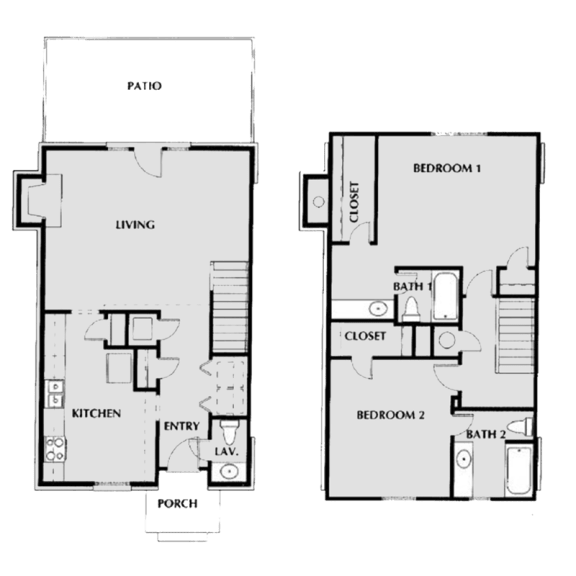
Identify the location of sinks. This screenshot has width=576, height=576. (462, 460), (227, 472).